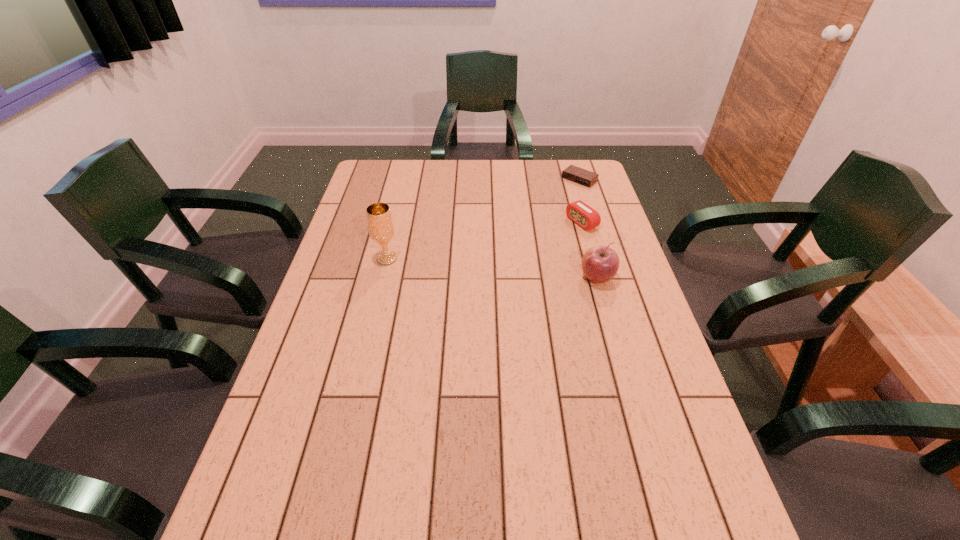
At what (x,y) coordinates should I click in order to perform the action: click on object that can be found as the second closest to the taller alarm clock. Please return your answer as a coordinate pair (x, y). This screenshot has width=960, height=540. Looking at the image, I should click on (600, 263).

Select which object appears as the closest to the chalice. Please provide its 2D coordinates. Your answer should be formatted as a tuple, i.e. [(x, y)], where the tuple contains the x and y coordinates of a point satisfying the conditions above.

[(600, 263)]

The height and width of the screenshot is (540, 960). Identify the location of free space that satisfies the following two spatial constraints: 1. on the back side of the shorter alarm clock; 2. on the left side of the apple. (569, 179).

At what (x,y) coordinates should I click in order to perform the action: click on vacant space that satisfies the following two spatial constraints: 1. on the back side of the shortest object; 2. on the left side of the second tallest object. Please return your answer as a coordinate pair (x, y). Looking at the image, I should click on (x=569, y=179).